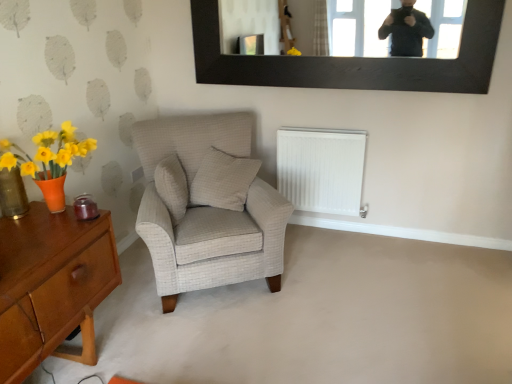
Question: Is black wood picture frame at upper center positioned far away from white plastic radiator at lower center?

Choices:
 (A) yes
 (B) no

Answer: (B)

Question: Can you confirm if black wood picture frame at upper center is positioned to the right of white plastic radiator at lower center?

Choices:
 (A) yes
 (B) no

Answer: (A)

Question: From the image's perspective, is black wood picture frame at upper center above white plastic radiator at lower center?

Choices:
 (A) no
 (B) yes

Answer: (B)

Question: From a real-world perspective, is black wood picture frame at upper center physically above white plastic radiator at lower center?

Choices:
 (A) yes
 (B) no

Answer: (A)

Question: Does black wood picture frame at upper center appear on the left side of white plastic radiator at lower center?

Choices:
 (A) yes
 (B) no

Answer: (B)

Question: Is black wood picture frame at upper center beside white plastic radiator at lower center?

Choices:
 (A) no
 (B) yes

Answer: (A)

Question: Considering the relative sizes of translucent amber glass vase at left and white checkered pillow at center, which is the 1th pillow from right to left, in the image provided, is translucent amber glass vase at left wider than white checkered pillow at center, which is the 1th pillow from right to left,?

Choices:
 (A) yes
 (B) no

Answer: (B)

Question: Is translucent amber glass vase at left closer to camera compared to white checkered pillow at center, the 2th pillow viewed from the left?

Choices:
 (A) yes
 (B) no

Answer: (A)

Question: Would you say white checkered pillow at center, which is the 1th pillow from right to left, is part of translucent amber glass vase at left's contents?

Choices:
 (A) yes
 (B) no

Answer: (B)

Question: From the image's perspective, is translucent amber glass vase at left on white checkered pillow at center, the 2th pillow viewed from the left?

Choices:
 (A) yes
 (B) no

Answer: (B)

Question: Is translucent amber glass vase at left taller than white checkered pillow at center, which is the 1th pillow from right to left?

Choices:
 (A) yes
 (B) no

Answer: (B)

Question: Is the position of translucent amber glass vase at left more distant than that of white checkered pillow at center, the 2th pillow viewed from the left?

Choices:
 (A) yes
 (B) no

Answer: (B)

Question: From a real-world perspective, does white checkered pillow at center, the 2th pillow viewed from the left, stand above beige textured pillow at center, positioned as the 1th pillow in left-to-right order?

Choices:
 (A) no
 (B) yes

Answer: (B)